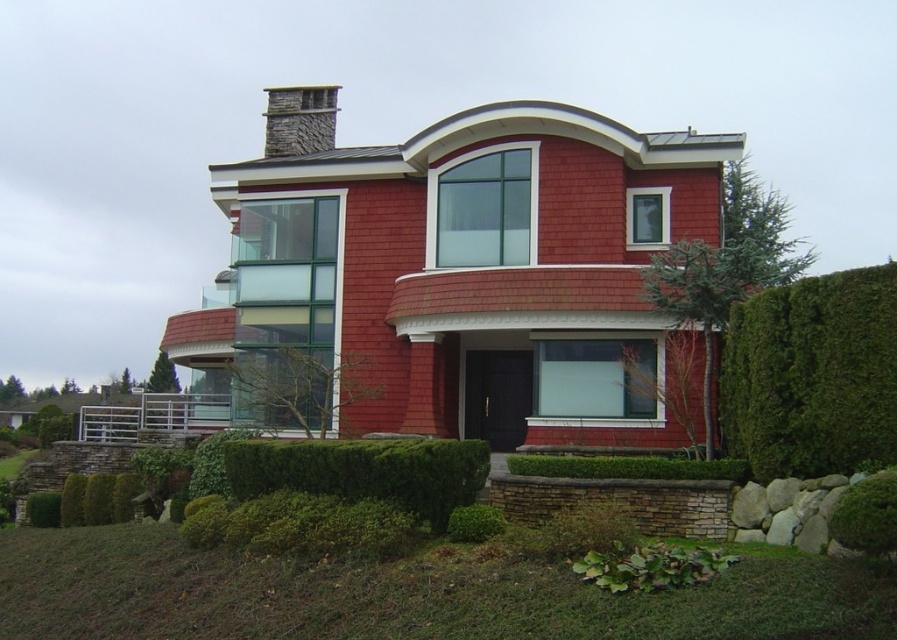
Looking at this image, who is positioned more to the right, green leafy hedge at right or stone chimney at upper center?

Positioned to the right is green leafy hedge at right.

Which is in front, point (816, 348) or point (274, 90)?

Point (816, 348)

Locate an element on the screen. green leafy hedge at right is located at coordinates (812, 376).

Is green leafy hedge at right bigger than green leafy hedge at lower center?

Yes, green leafy hedge at right is bigger than green leafy hedge at lower center.

Who is more distant from viewer, (x=743, y=380) or (x=371, y=484)?

Positioned behind is point (x=743, y=380).

Where is `green leafy hedge at right`? This screenshot has width=897, height=640. green leafy hedge at right is located at coordinates [812, 376].

Who is lower down, green leafy hedge at lower center or stone chimney at upper center?

green leafy hedge at lower center is lower down.

Which is in front, point (376, 449) or point (325, 118)?

Point (376, 449) is more forward.

Is point (314, 448) positioned before point (309, 131)?

Yes, it is in front of point (309, 131).

Locate an element on the screen. This screenshot has height=640, width=897. green leafy hedge at lower center is located at coordinates (364, 472).